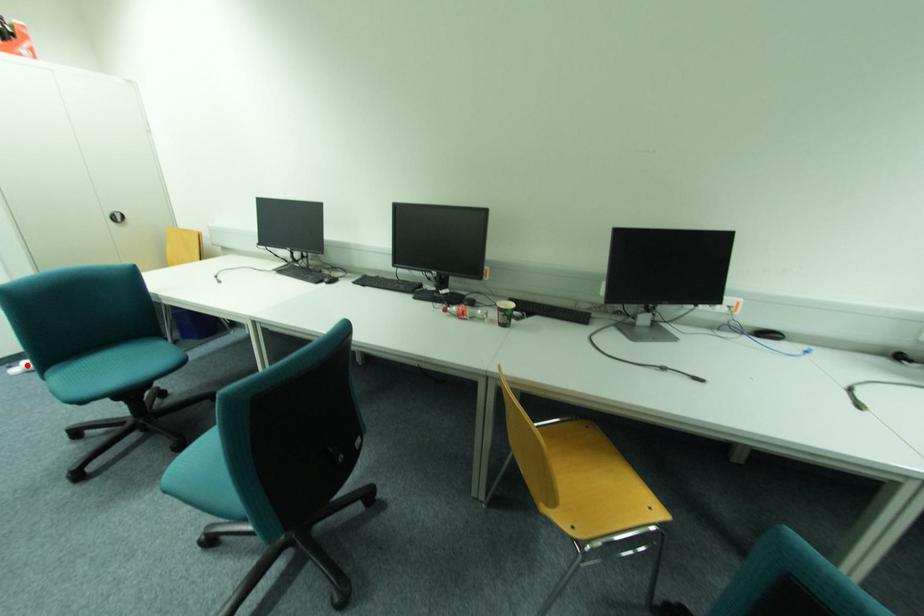
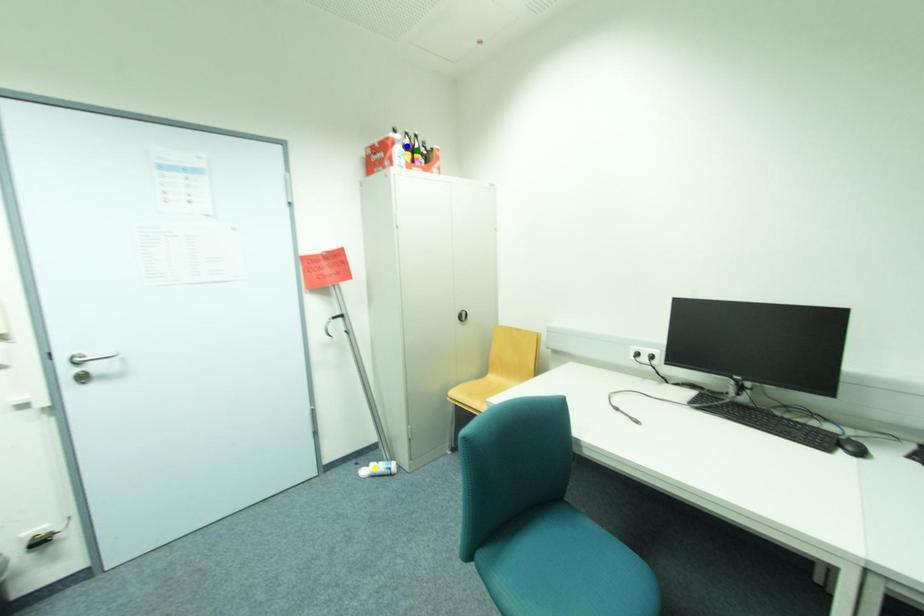
Question: I am providing you with two images of the same scene from different viewpoints. A red point is marked on the first image. You are given multiple points on the second image. Which spot in image 2 lines up with the point in image 1?

Choices:
 (A) green point
 (B) blue point
 (C) yellow point

Answer: (C)